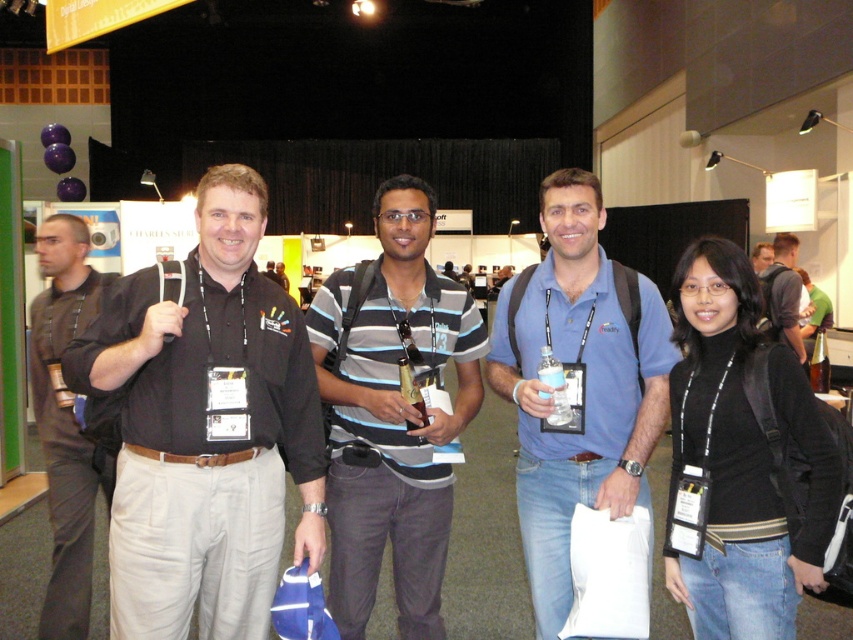
You are a photographer at the convention and need to capture a group photo of the striped cotton shirt at center and the black cotton shirt at left. The camera you are using has a minimum focus distance of 1 meter. Can you take the photo without moving either of them?

The striped cotton shirt at center is 1.12 meters away from the black cotton shirt at left. Since the minimum focus distance is 1 meter, the camera can focus on both subjects as they are within the required distance.

You are a photographer at the convention and need to take a photo of both the striped cotton shirt at center and the black matte turtleneck at center. Based on their positions, which one should you focus on first to ensure both are in frame?

The striped cotton shirt at center is located below the black matte turtleneck at center, so you should focus on the black matte turtleneck at center first to ensure both are in frame.